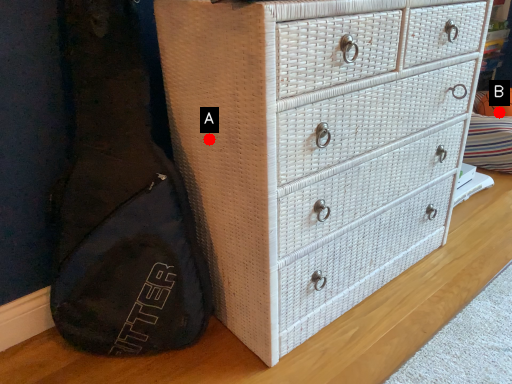
Question: Two points are circled on the image, labeled by A and B beside each circle. Which point appears farthest from the camera in this image?

Choices:
 (A) A is further
 (B) B is further

Answer: (B)